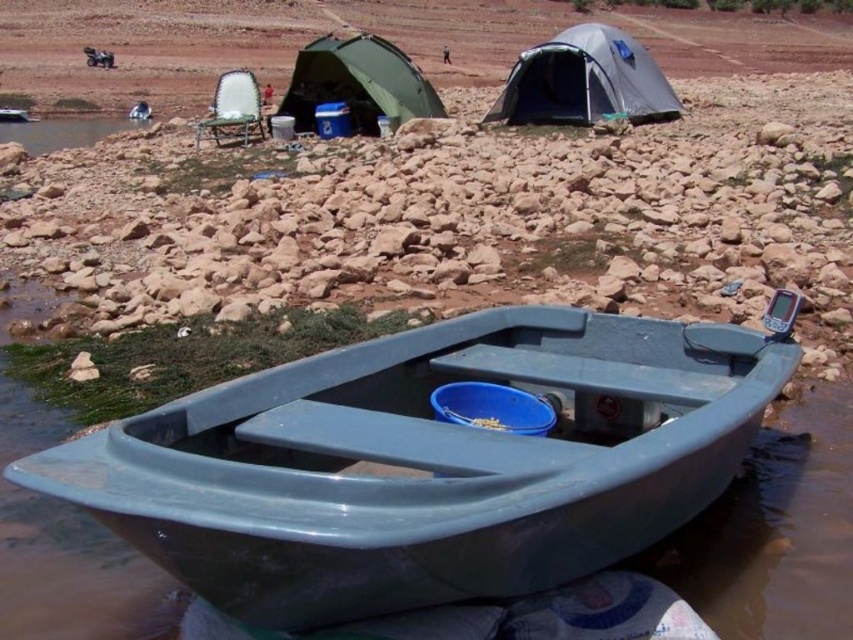
Measure the distance from matte plastic boat at lower center to gray fabric tent at upper center.

41.41 feet

This screenshot has width=853, height=640. What are the coordinates of `matte plastic boat at lower center` in the screenshot? It's located at (427, 461).

Is point (740, 380) positioned in front of point (640, 115)?

Yes, it is in front of point (640, 115).

This screenshot has height=640, width=853. What are the coordinates of `matte plastic boat at lower center` in the screenshot? It's located at point(427,461).

Can you confirm if gray fabric tent at upper center is wider than green fabric tent at upper center?

Yes.

Does point (659, 97) come in front of point (341, 88)?

No, it is not.

What are the coordinates of `gray fabric tent at upper center` in the screenshot? It's located at (584, 81).

Locate an element on the screen. The width and height of the screenshot is (853, 640). matte plastic boat at lower center is located at coordinates (427, 461).

What do you see at coordinates (427, 461) in the screenshot? I see `matte plastic boat at lower center` at bounding box center [427, 461].

The image size is (853, 640). I want to click on matte plastic boat at lower center, so click(x=427, y=461).